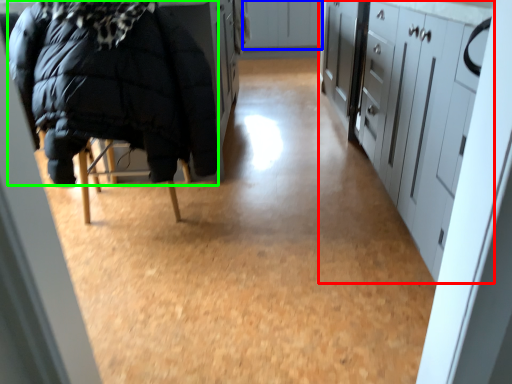
Question: Which object is positioned closest to cabinetry (highlighted by a red box)? Select from cabinetry (highlighted by a blue box) and jacket (highlighted by a green box).

Choices:
 (A) cabinetry
 (B) jacket

Answer: (B)